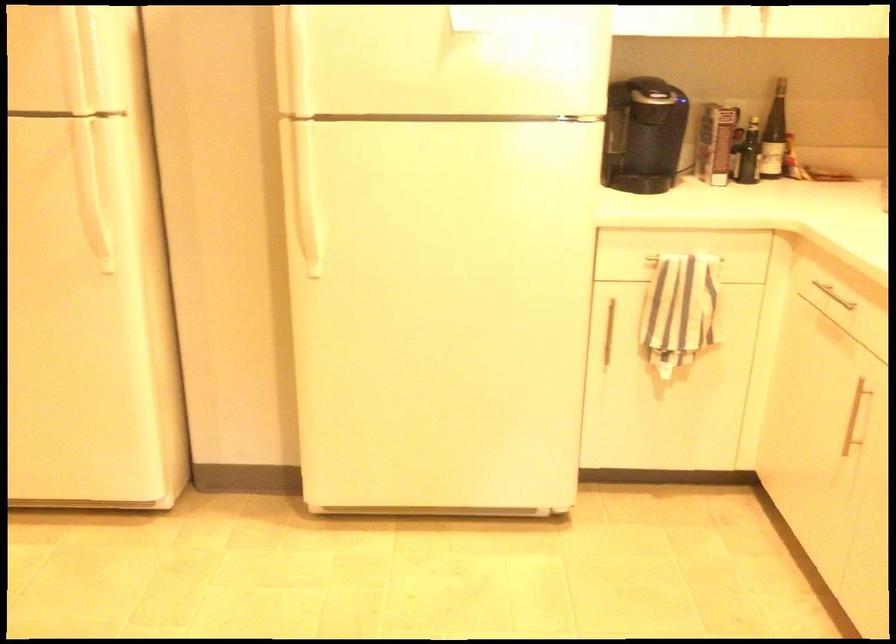
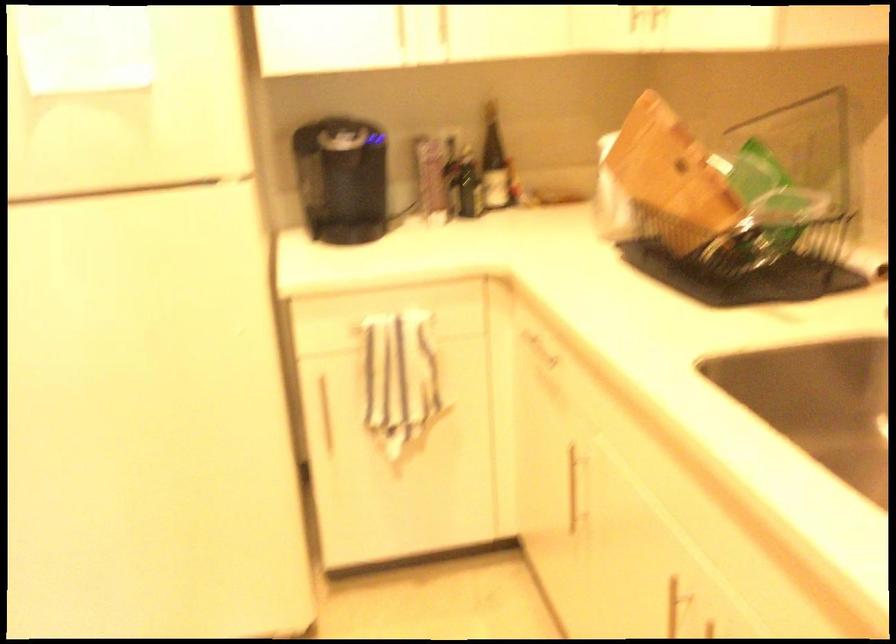
Question: Based on the continuous images, in which direction is the camera rotating? Reply with the corresponding letter.

Choices:
 (A) Left
 (B) Right
 (C) Up
 (D) Down

Answer: (B)